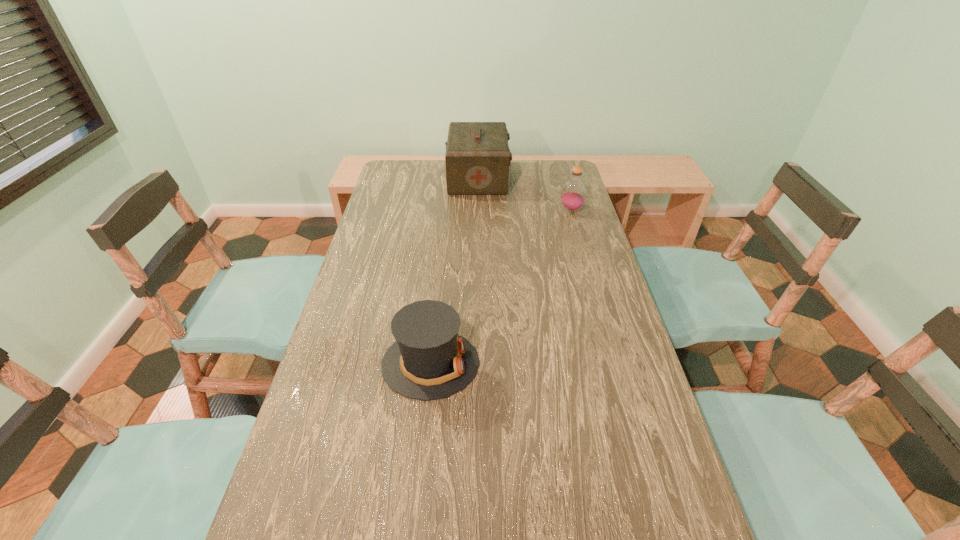
Where is `object that is at the right edge`? object that is at the right edge is located at coordinates (573, 195).

Identify the location of vacant region at the far edge of the desktop. (438, 180).

The image size is (960, 540). Find the location of `vacant space at the left edge of the desktop`. vacant space at the left edge of the desktop is located at coordinates (396, 203).

You are a GUI agent. You are given a task and a screenshot of the screen. Output one action in this format:
    pyautogui.click(x=<x>, y=<y>)
    Task: Click on the free space at the right edge
    The height and width of the screenshot is (540, 960).
    Given the screenshot: What is the action you would take?
    pyautogui.click(x=592, y=271)

The height and width of the screenshot is (540, 960). What are the coordinates of `vacant space at the far left corner` in the screenshot? It's located at (423, 166).

Find the location of a particular element. empty location between the tallest object and the dress hat is located at coordinates (454, 271).

Locate an element on the screen. free area in between the dress hat and the tallest object is located at coordinates (454, 271).

Find the location of a particular element. object that is the second nearest to the rightmost object is located at coordinates (429, 360).

What are the coordinates of `object that is the second closest one to the first-aid kit` in the screenshot? It's located at (429, 360).

Image resolution: width=960 pixels, height=540 pixels. I want to click on free point that satisfies the following two spatial constraints: 1. on the front side of the first-aid kit; 2. on the right side of the bottle, so click(x=478, y=210).